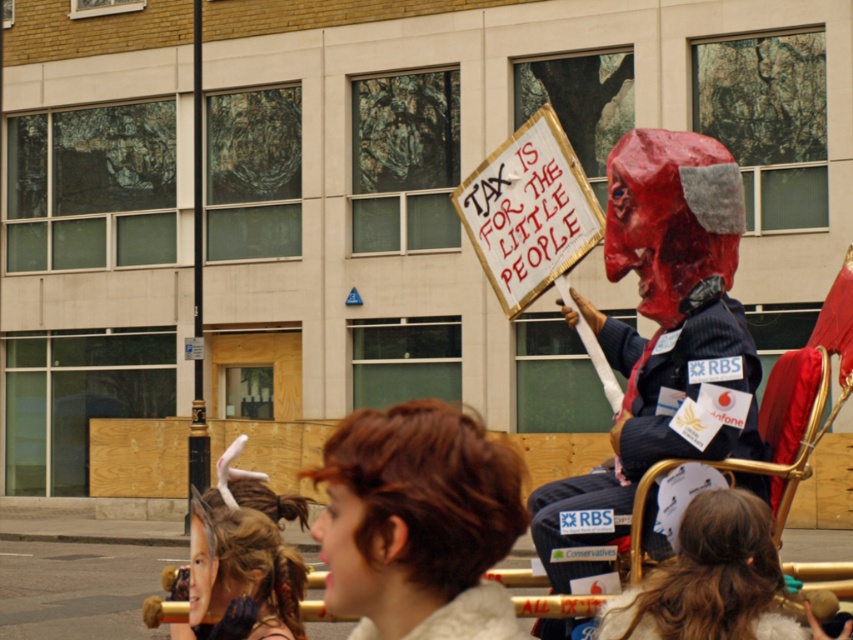
You are a photographer trying to capture both the matte red mask at center and the brown fur coat at center in a single frame. Since you can only focus on one object at a time, which object should you focus on to ensure the other remains in the background?

The matte red mask at center is to the right of brown fur coat at center. To ensure the brown fur coat at center stays in the background, focus on the matte red mask at center since it is closer to the camera.

You are a photographer trying to capture both the brown fur coat at center and the shiny gold hair at lower left in a single shot. Based on their positions, which object should you focus on first to ensure both are in frame?

Since the brown fur coat at center is to the right of the shiny gold hair at lower left, you should focus on the shiny gold hair at lower left first, then pan right to include the brown fur coat at center in your shot.